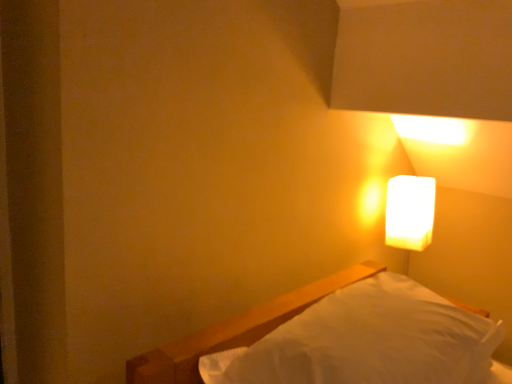
What do you see at coordinates (236, 331) in the screenshot? I see `white matte bed at lower right` at bounding box center [236, 331].

Identify the location of white matte bed at lower right. This screenshot has height=384, width=512. (236, 331).

In order to face white matte bed at lower right, should I rotate leftwards or rightwards?

To align with it, rotate right about 12.910°.

You are a GUI agent. You are given a task and a screenshot of the screen. Output one action in this format:
    pyautogui.click(x=<x>, y=<y>)
    Task: Click on the white matte bed at lower right
    The height and width of the screenshot is (384, 512).
    Given the screenshot: What is the action you would take?
    pyautogui.click(x=236, y=331)